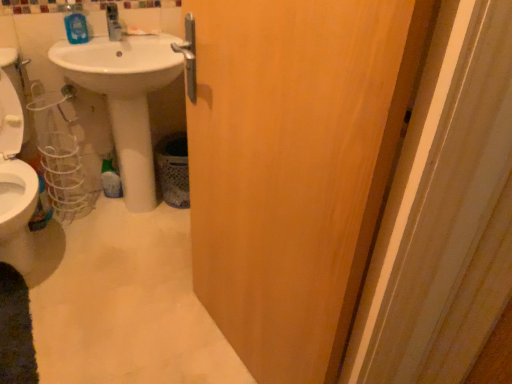
This screenshot has height=384, width=512. I want to click on free area below white glossy sink at center (from a real-world perspective), so click(137, 215).